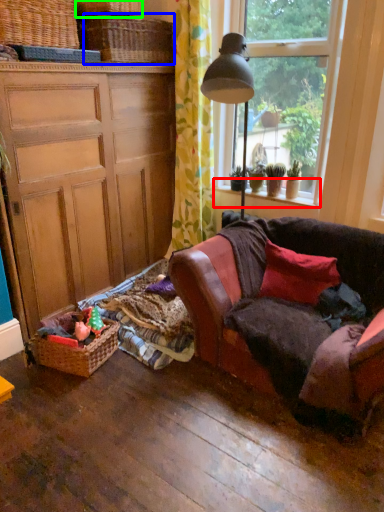
Question: Which object is positioned closest to window sill (highlighted by a red box)? Select from basket (highlighted by a blue box) and basket (highlighted by a green box).

Choices:
 (A) basket
 (B) basket

Answer: (A)